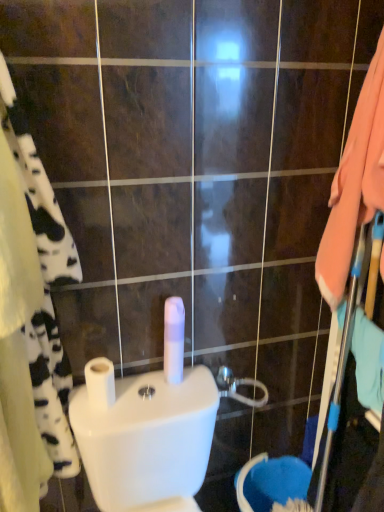
The width and height of the screenshot is (384, 512). Find the location of `vacant area that is in front of white matte toilet paper at center, the second toilet paper from the left`. vacant area that is in front of white matte toilet paper at center, the second toilet paper from the left is located at coordinates (162, 407).